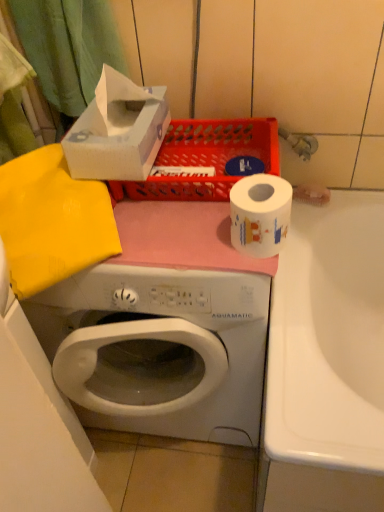
At what (x,y) coordinates should I click in order to perform the action: click on matte plastic basket at upper center. Please return your answer as a coordinate pair (x, y). Looking at the image, I should click on (206, 159).

From the picture: In order to face white cardboard tissue box at upper left, should I rotate leftwards or rightwards?

Turn left approximately 9.606 degrees to face it.

Locate an element on the screen. The width and height of the screenshot is (384, 512). white glossy toilet paper at center is located at coordinates (260, 214).

Is white cardboard tissue box at upper left taller than white glossy toilet paper at center?

Yes.

From the image's perspective, is white cardboard tissue box at upper left below white glossy toilet paper at center?

Incorrect, from the image's perspective, white cardboard tissue box at upper left is higher than white glossy toilet paper at center.

Is white cardboard tissue box at upper left in front of or behind white glossy toilet paper at center in the image?

Visually, white cardboard tissue box at upper left is located behind white glossy toilet paper at center.

Can you tell me how much white cardboard tissue box at upper left and white glossy toilet paper at center differ in facing direction?

The angular difference between white cardboard tissue box at upper left and white glossy toilet paper at center is 0.887 degrees.

From the picture: Is white glossy toilet paper at center inside the boundaries of matte plastic basket at upper center, or outside?

white glossy toilet paper at center cannot be found inside matte plastic basket at upper center.

Is white glossy toilet paper at center not close to matte plastic basket at upper center?

No, white glossy toilet paper at center is not far away from matte plastic basket at upper center.

From the picture: From the image's perspective, would you say white glossy toilet paper at center is shown under matte plastic basket at upper center?

Indeed, from the image's perspective, white glossy toilet paper at center is shown beneath matte plastic basket at upper center.

Is matte plastic basket at upper center positioned far away from white glossy toilet paper at center?

matte plastic basket at upper center is actually quite close to white glossy toilet paper at center.

Considering the relative sizes of matte plastic basket at upper center and white glossy toilet paper at center in the image provided, is matte plastic basket at upper center smaller than white glossy toilet paper at center?

Actually, matte plastic basket at upper center might be larger than white glossy toilet paper at center.

The height and width of the screenshot is (512, 384). Identify the location of basket above the white glossy toilet paper at center (from the image's perspective). (206, 159).

Is the position of matte plastic basket at upper center less distant than that of white glossy toilet paper at center?

No, it is behind white glossy toilet paper at center.

From the image's perspective, which is below, matte plastic basket at upper center or white cardboard tissue box at upper left?

matte plastic basket at upper center is shown below in the image.

Consider the image. Between matte plastic basket at upper center and white cardboard tissue box at upper left, which one is positioned behind?

Positioned behind is matte plastic basket at upper center.

Between matte plastic basket at upper center and white cardboard tissue box at upper left, which one appears on the left side from the viewer's perspective?

From the viewer's perspective, white cardboard tissue box at upper left appears more on the left side.

Considering the relative sizes of white cardboard tissue box at upper left and matte plastic basket at upper center in the image provided, is white cardboard tissue box at upper left shorter than matte plastic basket at upper center?

No.

Is point (65, 135) farther from camera compared to point (191, 129)?

That is True.

Could you tell me if white cardboard tissue box at upper left is facing matte plastic basket at upper center?

No.

What's the angular difference between white cardboard tissue box at upper left and matte plastic basket at upper center's facing directions?

0.000242 degrees.

This screenshot has width=384, height=512. Identify the location of storage box lying above the white glossy toilet paper at center (from the image's perspective). (117, 131).

In terms of width, does white glossy toilet paper at center look wider or thinner when compared to white cardboard tissue box at upper left?

In the image, white glossy toilet paper at center appears to be more narrow than white cardboard tissue box at upper left.

Between white glossy toilet paper at center and white cardboard tissue box at upper left, which one has more height?

With more height is white cardboard tissue box at upper left.

Between white glossy toilet paper at center and white cardboard tissue box at upper left, which one has smaller size?

With smaller size is white glossy toilet paper at center.

Identify the location of storage box on the left of white glossy toilet paper at center. Image resolution: width=384 pixels, height=512 pixels. (117, 131).

Locate an element on the screen. This screenshot has width=384, height=512. toilet paper that appears above the matte plastic basket at upper center (from a real-world perspective) is located at coordinates (260, 214).

Considering their positions, is white glossy toilet paper at center positioned closer to matte plastic basket at upper center than white cardboard tissue box at upper left?

white cardboard tissue box at upper left is positioned closer to the anchor matte plastic basket at upper center.

From the picture: Considering their positions, is white cardboard tissue box at upper left positioned further to matte plastic basket at upper center than white glossy toilet paper at center?

white glossy toilet paper at center is positioned further to the anchor matte plastic basket at upper center.

Estimate the real-world distances between objects in this image. Which object is further from white cardboard tissue box at upper left, white glossy toilet paper at center or matte plastic basket at upper center?

The object further to white cardboard tissue box at upper left is white glossy toilet paper at center.

From the image, which object appears to be farther from white glossy toilet paper at center, white cardboard tissue box at upper left or matte plastic basket at upper center?

Among the two, white cardboard tissue box at upper left is located further to white glossy toilet paper at center.

From the image, which object appears to be farther from white glossy toilet paper at center, matte plastic basket at upper center or white cardboard tissue box at upper left?

white cardboard tissue box at upper left is positioned further to the anchor white glossy toilet paper at center.

Estimate the real-world distances between objects in this image. Which object is closer to white cardboard tissue box at upper left, matte plastic basket at upper center or white glossy toilet paper at center?

matte plastic basket at upper center is closer to white cardboard tissue box at upper left.

Locate an element on the screen. The image size is (384, 512). basket between white cardboard tissue box at upper left and white glossy toilet paper at center from left to right is located at coordinates (206, 159).